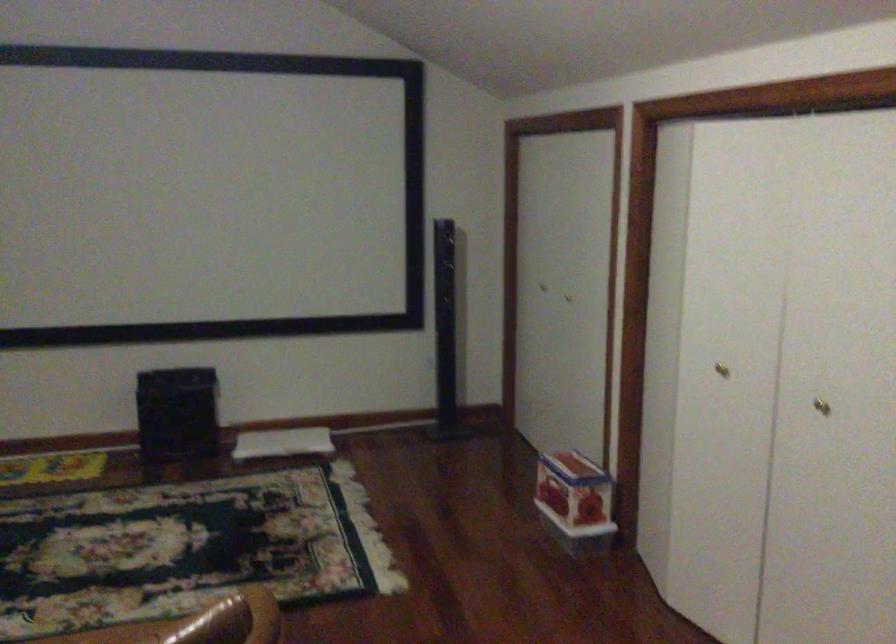
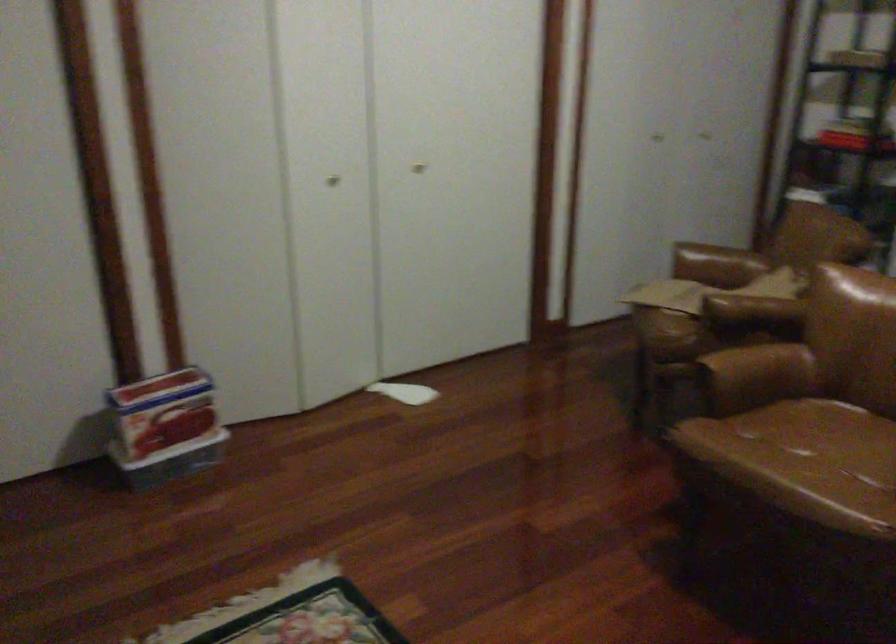
Where in the second image is the point corresponding to (574,494) from the first image?

(218, 390)